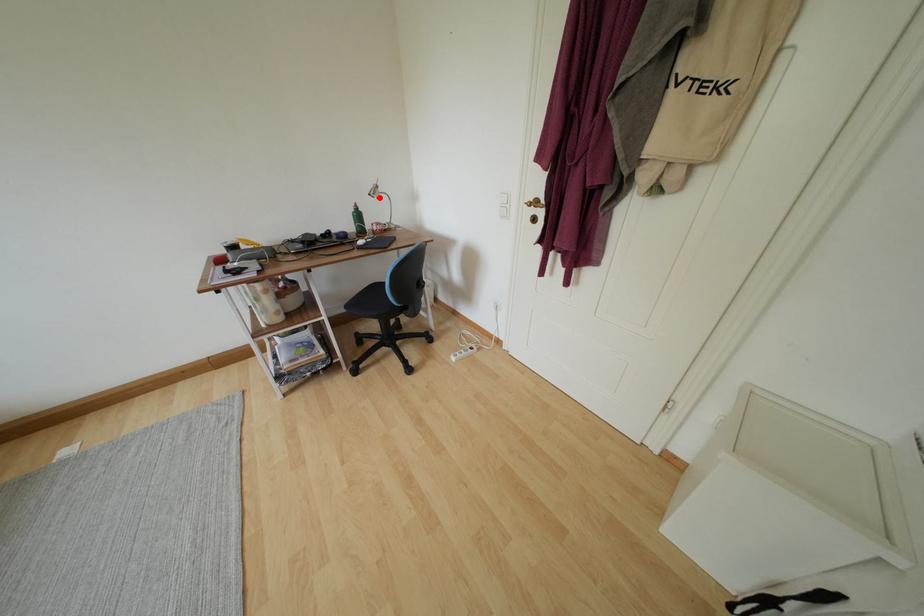
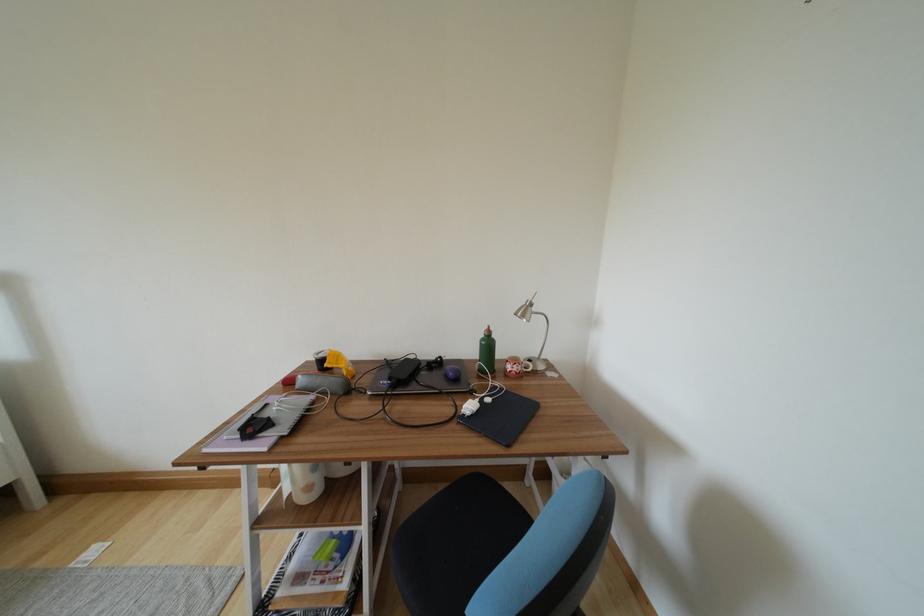
Question: I am providing you with two images of the same scene from different viewpoints. Image1 has a red point marked. In image2, the corresponding 3D location appears at what relative position? Reply with the corresponding letter.

Choices:
 (A) Closer
 (B) Farther

Answer: (B)